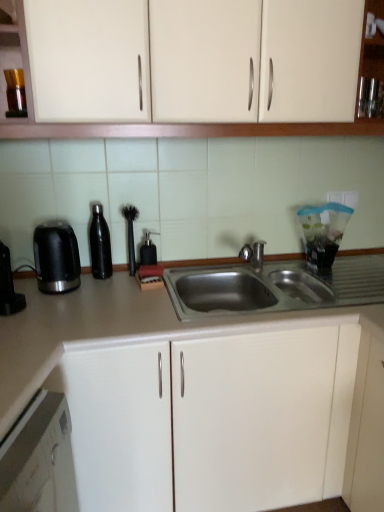
Image resolution: width=384 pixels, height=512 pixels. Describe the element at coordinates (8, 286) in the screenshot. I see `black plastic coffee machine at left` at that location.

This screenshot has height=512, width=384. In order to click on matte gray countertop at center in this screenshot , I will do `click(123, 327)`.

This screenshot has width=384, height=512. Describe the element at coordinates (123, 327) in the screenshot. I see `matte gray countertop at center` at that location.

Measure the distance between point (28, 97) and camera.

Point (28, 97) and camera are 1.24 meters apart.

Where is `clear plastic blender at right, the 3th appliance from the left`? The height and width of the screenshot is (512, 384). clear plastic blender at right, the 3th appliance from the left is located at coordinates (323, 233).

The height and width of the screenshot is (512, 384). What are the coordinates of `black plastic coffee machine at left` in the screenshot? It's located at [8, 286].

From the image's perspective, is clear plastic blender at right, placed as the 1th appliance when sorted from right to left, over matte white cabinets at upper center?

No, from the image's perspective, clear plastic blender at right, placed as the 1th appliance when sorted from right to left, is not on top of matte white cabinets at upper center.

Locate an element on the screen. Image resolution: width=384 pixels, height=512 pixels. appliance on the right of matte white cabinets at upper center is located at coordinates 323,233.

Is clear plastic blender at right, placed as the 1th appliance when sorted from right to left, further to the viewer compared to matte white cabinets at upper center?

Yes, clear plastic blender at right, placed as the 1th appliance when sorted from right to left, is behind matte white cabinets at upper center.

From a real-world perspective, who is located lower, clear plastic blender at right, placed as the 1th appliance when sorted from right to left, or matte white cabinets at upper center?

In real-world perspective, clear plastic blender at right, placed as the 1th appliance when sorted from right to left, is lower.

Where is `coffee machine below the black rubber brush at center, arranged as the second appliance when viewed from the right (from a real-world perspective)`? The image size is (384, 512). coffee machine below the black rubber brush at center, arranged as the second appliance when viewed from the right (from a real-world perspective) is located at coordinates (8, 286).

Which point is more forward, (8, 302) or (132, 267)?

Point (8, 302)

From the image's perspective, relative to black rubber brush at center, arranged as the second appliance when viewed from the right, is black plastic coffee machine at left above or below?

Clearly, from the image's perspective, black plastic coffee machine at left is below black rubber brush at center, arranged as the second appliance when viewed from the right.

Is black plastic coffee machine at left thinner than black rubber brush at center, acting as the second appliance starting from the left?

Incorrect, the width of black plastic coffee machine at left is not less than that of black rubber brush at center, acting as the second appliance starting from the left.

Looking at their sizes, would you say black rubber brush at center, arranged as the second appliance when viewed from the right, is wider or thinner than black matte water bottle at left, which is the third appliance from right to left?

Clearly, black rubber brush at center, arranged as the second appliance when viewed from the right, has less width compared to black matte water bottle at left, which is the third appliance from right to left.

Can you tell me how much black rubber brush at center, acting as the second appliance starting from the left, and black matte water bottle at left, which is counted as the first appliance, starting from the left, differ in facing direction?

The facing directions of black rubber brush at center, acting as the second appliance starting from the left, and black matte water bottle at left, which is counted as the first appliance, starting from the left, are 0.00183 degrees apart.

Is black rubber brush at center, acting as the second appliance starting from the left, completely or partially outside of black matte water bottle at left, which is the third appliance from right to left?

Yes, black rubber brush at center, acting as the second appliance starting from the left, is outside of black matte water bottle at left, which is the third appliance from right to left.

Is black rubber brush at center, acting as the second appliance starting from the left, further to camera compared to black matte water bottle at left, which is the third appliance from right to left?

Yes, black rubber brush at center, acting as the second appliance starting from the left, is behind black matte water bottle at left, which is the third appliance from right to left.

Is black plastic kettle at left facing away from black plastic coffee machine at left?

No, black plastic coffee machine at left is not at the back of black plastic kettle at left.

From a real-world perspective, between black plastic kettle at left and black plastic coffee machine at left, who is vertically lower?

In real-world perspective, black plastic coffee machine at left is lower.

Which of these two, black plastic kettle at left or black plastic coffee machine at left, is bigger?

With larger size is black plastic kettle at left.

Considering the positions of objects black plastic kettle at left and black plastic coffee machine at left in the image provided, who is behind, black plastic kettle at left or black plastic coffee machine at left?

black plastic kettle at left.

Between black plastic coffee machine at left and black matte water bottle at left, which is counted as the first appliance, starting from the left, which one has larger size?

black plastic coffee machine at left.

Is black plastic coffee machine at left inside or outside of black matte water bottle at left, which is the third appliance from right to left?

black plastic coffee machine at left is spatially situated outside black matte water bottle at left, which is the third appliance from right to left.

Is the position of black plastic coffee machine at left more distant than that of black matte water bottle at left, which is the third appliance from right to left?

No.

Is black plastic coffee machine at left facing towards black matte water bottle at left, which is the third appliance from right to left?

No, black plastic coffee machine at left is not aimed at black matte water bottle at left, which is the third appliance from right to left.

Between black plastic kettle at left and matte gray countertop at center, which one has smaller width?

With smaller width is black plastic kettle at left.

Could matte gray countertop at center be considered to be inside black plastic kettle at left?

No, matte gray countertop at center is not inside black plastic kettle at left.

This screenshot has width=384, height=512. In order to click on kitchen appliance above the matte gray countertop at center (from the image's perspective) in this screenshot , I will do `click(56, 257)`.

Is black plastic kettle at left positioned with its back to matte gray countertop at center?

black plastic kettle at left is not turned away from matte gray countertop at center.

Is clear plastic blender at right, the 3th appliance from the left, positioned beyond the bounds of black plastic coffee machine at left?

clear plastic blender at right, the 3th appliance from the left, is positioned outside black plastic coffee machine at left.

Is clear plastic blender at right, placed as the 1th appliance when sorted from right to left, bigger than black plastic coffee machine at left?

Correct, clear plastic blender at right, placed as the 1th appliance when sorted from right to left, is larger in size than black plastic coffee machine at left.

From the image's perspective, which one is positioned higher, clear plastic blender at right, placed as the 1th appliance when sorted from right to left, or black plastic coffee machine at left?

clear plastic blender at right, placed as the 1th appliance when sorted from right to left, is shown above in the image.

Is clear plastic blender at right, the 3th appliance from the left, taller or shorter than black plastic coffee machine at left?

Clearly, clear plastic blender at right, the 3th appliance from the left, is taller compared to black plastic coffee machine at left.

Locate an element on the screen. Image resolution: width=384 pixels, height=512 pixels. cabinetry that is above the clear plastic blender at right, the 3th appliance from the left (from the image's perspective) is located at coordinates 162,123.

The image size is (384, 512). Find the location of `coffee machine on the left of black rubber brush at center, acting as the second appliance starting from the left`. coffee machine on the left of black rubber brush at center, acting as the second appliance starting from the left is located at coordinates (8, 286).

Considering their positions, is black plastic kettle at left positioned closer to clear plastic blender at right, placed as the 1th appliance when sorted from right to left, than black matte water bottle at left, which is counted as the first appliance, starting from the left?

The object closer to clear plastic blender at right, placed as the 1th appliance when sorted from right to left, is black matte water bottle at left, which is counted as the first appliance, starting from the left.

Which object lies further to the anchor point black matte water bottle at left, which is counted as the first appliance, starting from the left, matte gray countertop at center or clear plastic blender at right, the 3th appliance from the left?

clear plastic blender at right, the 3th appliance from the left, is positioned further to the anchor black matte water bottle at left, which is counted as the first appliance, starting from the left.

Which object lies nearer to the anchor point matte white cabinets at upper center, matte gray countertop at center or black rubber brush at center, arranged as the second appliance when viewed from the right?

black rubber brush at center, arranged as the second appliance when viewed from the right, lies closer to matte white cabinets at upper center than the other object.

From the picture: Estimate the real-world distances between objects in this image. Which object is closer to black plastic kettle at left, black rubber brush at center, acting as the second appliance starting from the left, or matte gray countertop at center?

matte gray countertop at center lies closer to black plastic kettle at left than the other object.

Which object lies further to the anchor point matte white cabinets at upper center, matte gray countertop at center or black plastic coffee machine at left?

Among the two, black plastic coffee machine at left is located further to matte white cabinets at upper center.

From the image, which object appears to be nearer to matte white cabinets at upper center, black plastic kettle at left or black plastic coffee machine at left?

Among the two, black plastic kettle at left is located nearer to matte white cabinets at upper center.

Considering their positions, is black plastic kettle at left positioned further to matte gray countertop at center than black matte water bottle at left, which is counted as the first appliance, starting from the left?

Among the two, black matte water bottle at left, which is counted as the first appliance, starting from the left, is located further to matte gray countertop at center.

Looking at the image, which one is located further to clear plastic blender at right, the 3th appliance from the left, black plastic coffee machine at left or matte white cabinets at upper center?

black plastic coffee machine at left is further to clear plastic blender at right, the 3th appliance from the left.

Find the location of a particular element. The image size is (384, 512). appliance located between black plastic coffee machine at left and black rubber brush at center, arranged as the second appliance when viewed from the right, in the left-right direction is located at coordinates (99, 243).

Where is `kitchen appliance between matte white cabinets at upper center and black plastic coffee machine at left from top to bottom`? kitchen appliance between matte white cabinets at upper center and black plastic coffee machine at left from top to bottom is located at coordinates (56, 257).

Where is `appliance located between black matte water bottle at left, which is counted as the first appliance, starting from the left, and clear plastic blender at right, placed as the 1th appliance when sorted from right to left, in the left-right direction`? This screenshot has width=384, height=512. appliance located between black matte water bottle at left, which is counted as the first appliance, starting from the left, and clear plastic blender at right, placed as the 1th appliance when sorted from right to left, in the left-right direction is located at coordinates (130, 234).

Locate an element on the screen. This screenshot has width=384, height=512. kitchen appliance between black plastic coffee machine at left and clear plastic blender at right, the 3th appliance from the left, in the horizontal direction is located at coordinates (56, 257).